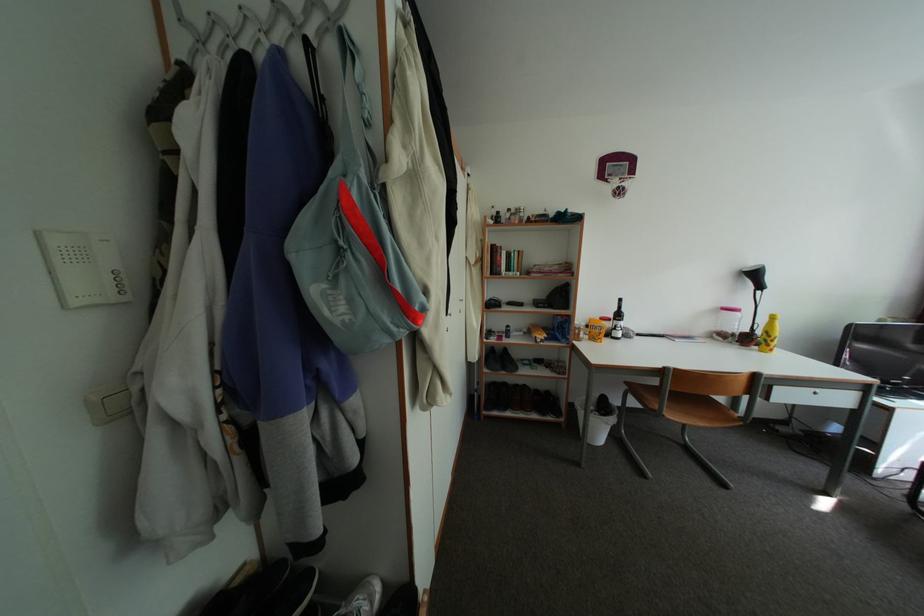
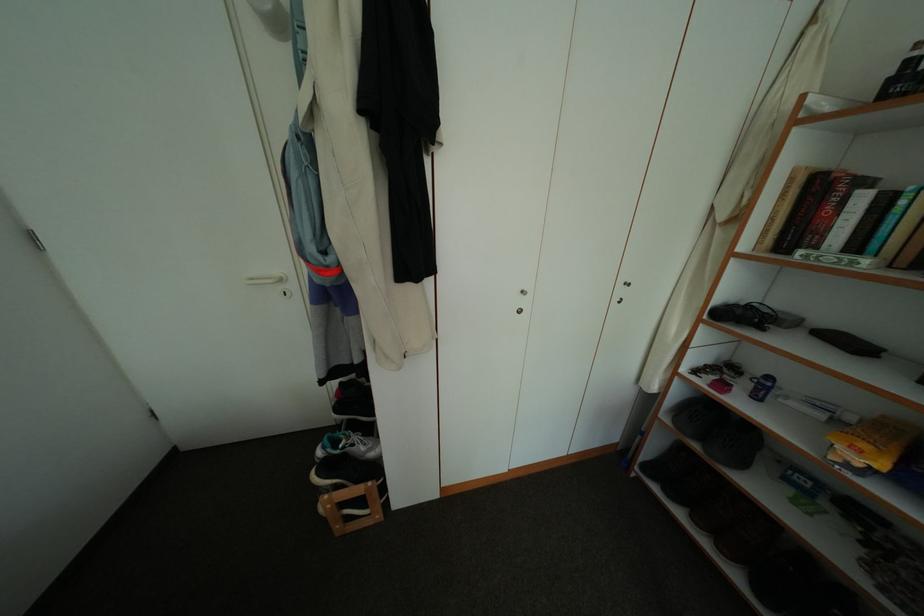
The images are taken continuously from a first-person perspective. In which direction is your viewpoint rotating?

The camera rotated toward left-down.